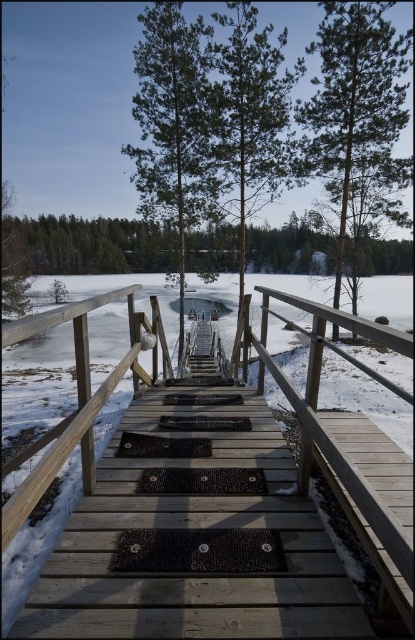
Question: Estimate the real-world distances between objects in this image. Which object is closer to the wooden bridge at center?

Choices:
 (A) green textured pine tree at center
 (B) green textured pine at center

Answer: (A)

Question: Which point is farther from the camera taking this photo?

Choices:
 (A) (393, 124)
 (B) (165, 196)

Answer: (B)

Question: Can you confirm if wooden bridge at center is positioned above green textured pine at center?

Choices:
 (A) yes
 (B) no

Answer: (B)

Question: Which point appears farthest from the camera in this image?

Choices:
 (A) (376, 81)
 (B) (146, 145)
 (C) (273, 138)
 (D) (283, 618)

Answer: (B)

Question: In this image, where is green textured pine at center located relative to green textured pine tree at center?

Choices:
 (A) below
 (B) above

Answer: (A)

Question: Is green textured pine at center to the left of green textured pine tree at center from the viewer's perspective?

Choices:
 (A) yes
 (B) no

Answer: (B)